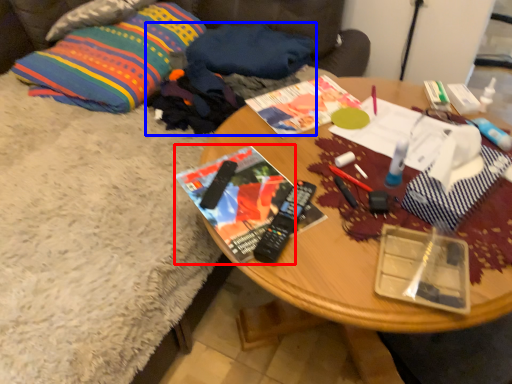
Question: Which object appears closest to the camera in this image, magazine (highlighted by a red box) or clothing (highlighted by a blue box)?

Choices:
 (A) magazine
 (B) clothing

Answer: (A)